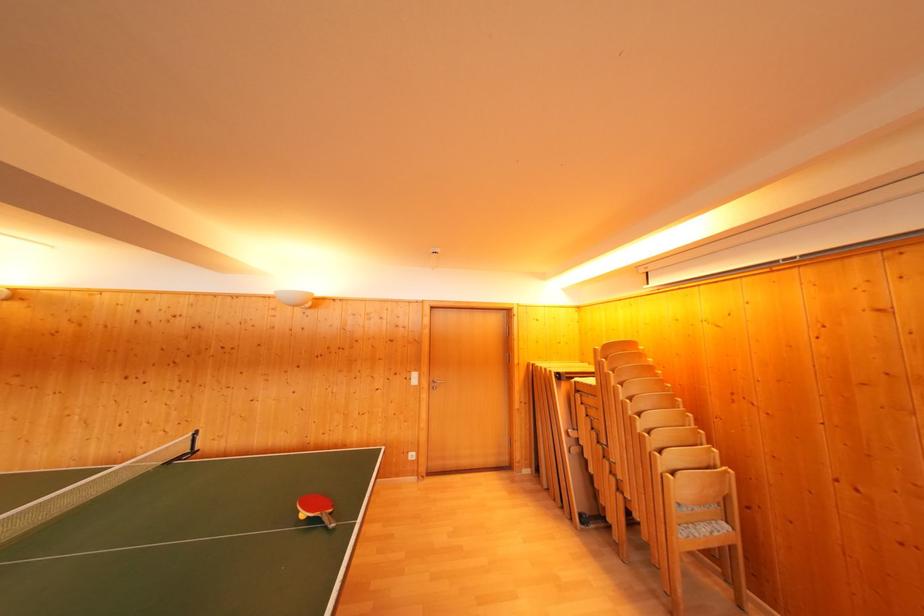
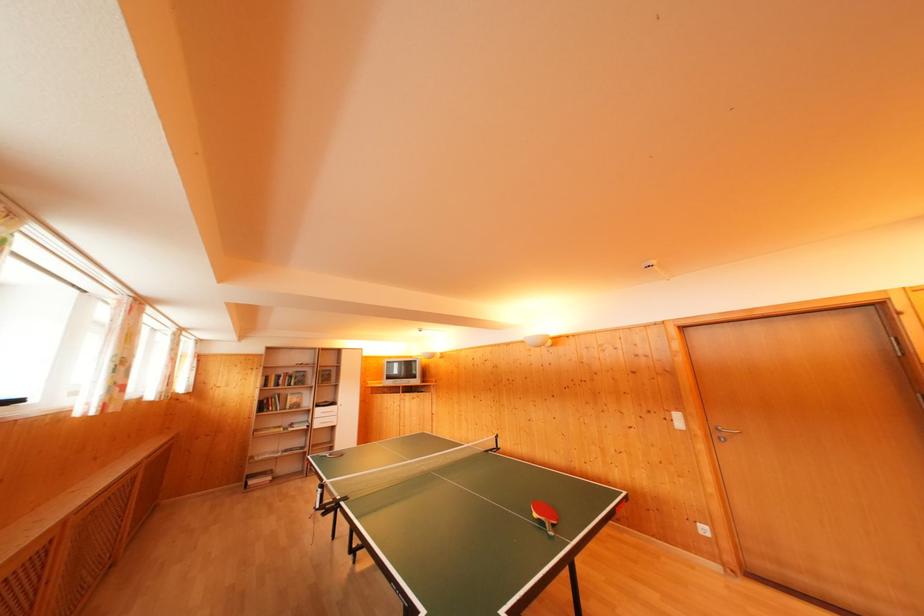
Find the pixel in the second image that matches the point at 417,461 in the first image.

(709, 535)